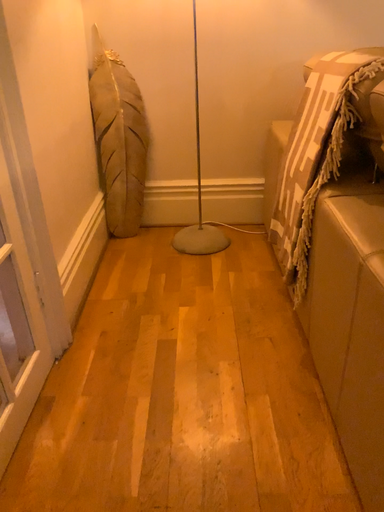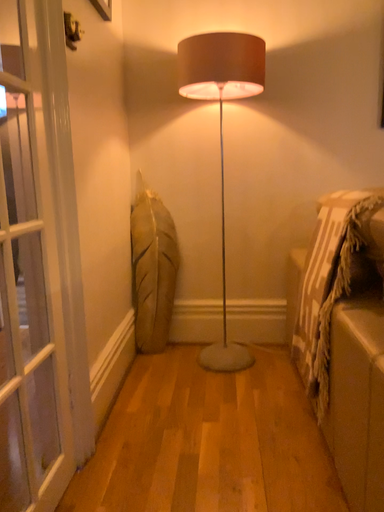
Question: Which way did the camera rotate in the video?

Choices:
 (A) rotated upward
 (B) rotated downward

Answer: (A)